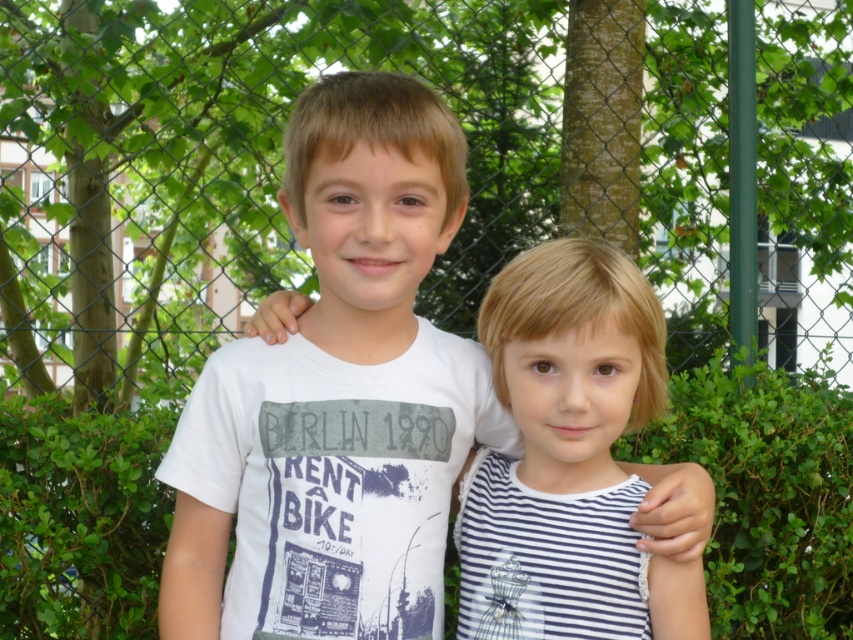
Question: Which object is positioned farthest from the metallic chain-link fence at upper center?

Choices:
 (A) white striped dress at center
 (B) green leafy hedge at center

Answer: (A)

Question: Does metallic chain-link fence at upper center lie behind white striped dress at center?

Choices:
 (A) no
 (B) yes

Answer: (B)

Question: Where is metallic chain-link fence at upper center located in relation to white cotton shirt at center in the image?

Choices:
 (A) above
 (B) below

Answer: (A)

Question: Which point is farther to the camera?

Choices:
 (A) (787, 403)
 (B) (555, 6)
 (C) (378, 186)
 (D) (575, 548)

Answer: (B)

Question: Is metallic chain-link fence at upper center to the left of green leafy hedge at center from the viewer's perspective?

Choices:
 (A) yes
 (B) no

Answer: (A)

Question: Which object is positioned closest to the white striped dress at center?

Choices:
 (A) metallic chain-link fence at upper center
 (B) white cotton shirt at center

Answer: (B)